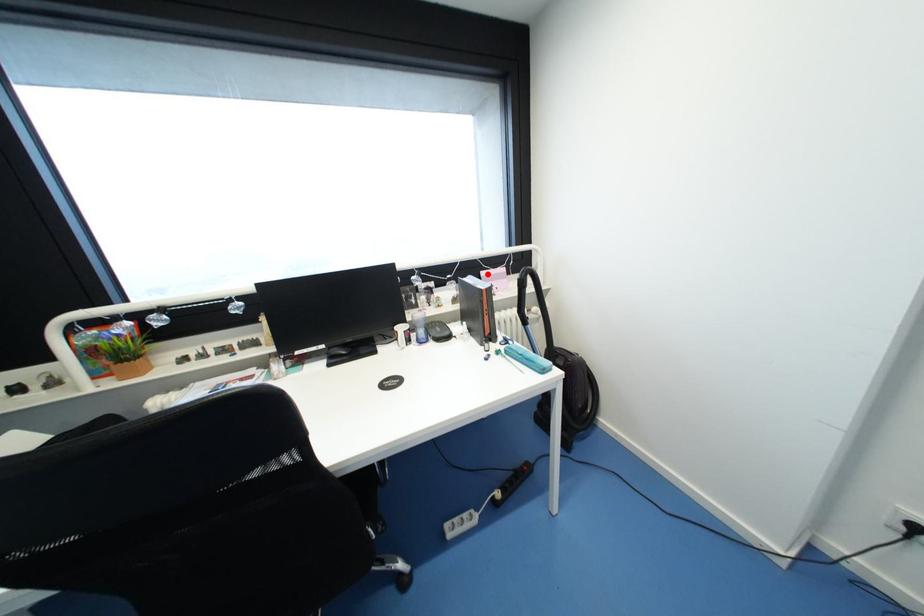
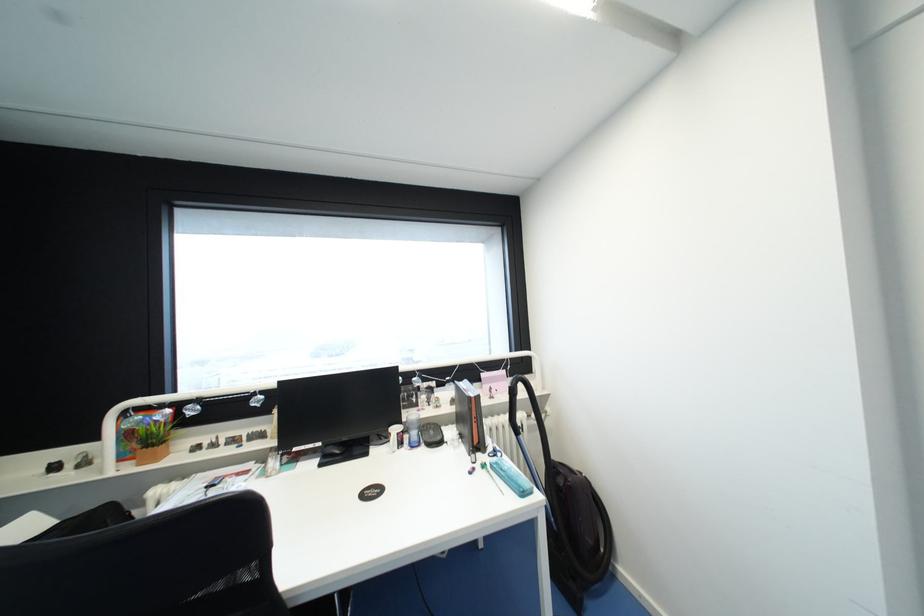
Question: I am providing you with two images of the same scene from different viewpoints. A red point is marked on the first image. At the location where the point appears in image 1, is it still visible in image 2?

Choices:
 (A) Yes
 (B) No

Answer: (A)